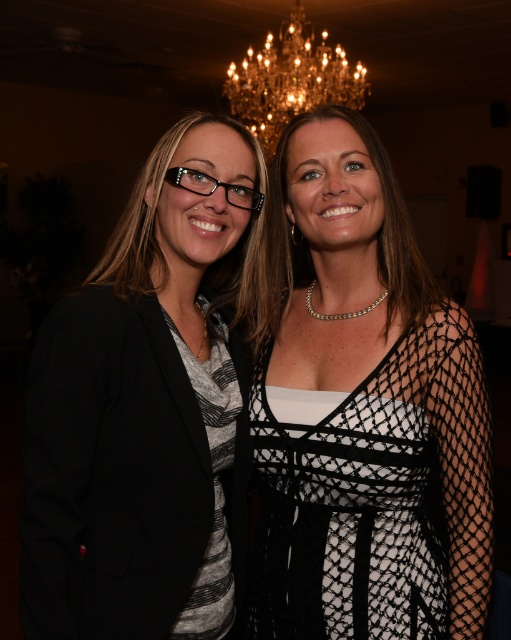
You are a photographer standing at the entrance of the room. You want to take a photo of the black matte blazer at left and the crystal chandelier at upper center in the same frame. Considering the distance between them, can you fit both into your camera viewfinder without moving closer or further away?

The distance between the black matte blazer at left and the crystal chandelier at upper center is 3.71 meters. Whether they can be captured in the same frame depends on your camera lens. A standard lens with a focal length of around 50mm might allow both objects to be in the frame from your current position, but this also depends on the camera sensor size and field of view. If you have a wide angle lens, it would be easier to include both in the frame without moving.

You are a photographer setting up for an indoor event. You notice the black mesh dress at center and the crystal chandelier at upper center. Which object is closer to the camera? Please explain your reasoning based on their positions in the scene.

The black mesh dress at center is closer to the camera because it is positioned in front of the crystal chandelier at upper center, meaning the dress is between the camera and the chandelier.